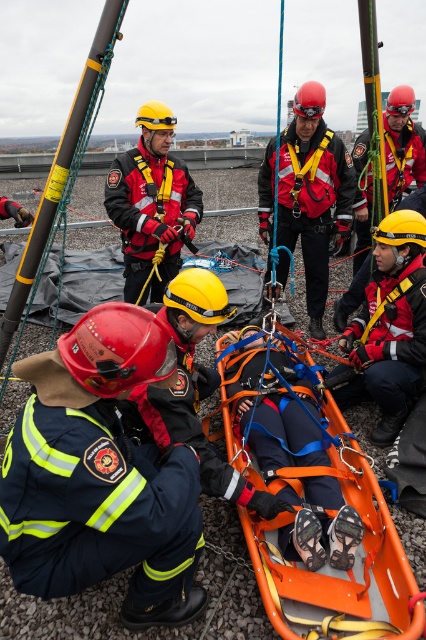
You are a rescue worker on the rooftop. You need to retrieve an item from the red fabric helmet at lower left, but you are currently standing near the orange fabric stretcher at center. Can you reach the helmet without moving from your current position?

The red fabric helmet at lower left is below orange fabric stretcher at center, so you can reach it without moving from your current position.

You are a safety inspector reviewing the rescue operation. The orange fabric stretcher at center and the red hard hat at center are both at the center of the scene. Which object is smaller?

The orange fabric stretcher at center is smaller than the red hard hat at center.

You are a safety inspector reviewing the rescue operation on the rooftop. You notice two helmets, the red fabric helmet at lower left and the matte black helmet at center. Which helmet has a smaller size?

The red fabric helmet at lower left has a smaller size compared to the matte black helmet at center.